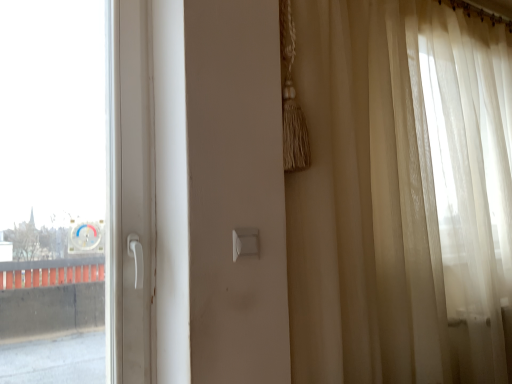
The width and height of the screenshot is (512, 384). I want to click on sheer beige curtain at right, so click(399, 196).

Describe the element at coordinates (399, 196) in the screenshot. I see `sheer beige curtain at right` at that location.

What do you see at coordinates (245, 242) in the screenshot?
I see `white plastic light switch at center` at bounding box center [245, 242].

Find the location of a particular element. This screenshot has width=512, height=384. white plastic light switch at center is located at coordinates (245, 242).

At what (x,y) coordinates should I click in order to perform the action: click on sheer beige curtain at right. Please return your answer as a coordinate pair (x, y). The height and width of the screenshot is (384, 512). Looking at the image, I should click on (399, 196).

Which object is positioned more to the left, sheer beige curtain at right or white plastic light switch at center?

Positioned to the left is white plastic light switch at center.

Which object is closer to the camera taking this photo, sheer beige curtain at right or white plastic light switch at center?

sheer beige curtain at right is closer to the camera.

Which is behind, point (362, 250) or point (233, 239)?

Point (362, 250)

From the image's perspective, relative to white plastic light switch at center, is sheer beige curtain at right above or below?

From the image's perspective, sheer beige curtain at right appears above white plastic light switch at center.

From a real-world perspective, which object stands above the other?

From a 3D spatial view, sheer beige curtain at right is above.

Which of these two, sheer beige curtain at right or white plastic light switch at center, is wider?

With larger width is sheer beige curtain at right.

In terms of height, does sheer beige curtain at right look taller or shorter compared to white plastic light switch at center?

In the image, sheer beige curtain at right appears to be taller than white plastic light switch at center.

Can you confirm if sheer beige curtain at right is bigger than white plastic light switch at center?

Yes.

Is sheer beige curtain at right inside or outside of white plastic light switch at center?

sheer beige curtain at right is spatially situated outside white plastic light switch at center.

Is sheer beige curtain at right directly adjacent to white plastic light switch at center?

No, sheer beige curtain at right is not beside white plastic light switch at center.

Is white plastic light switch at center at the back of sheer beige curtain at right?

No.

From the picture: How different are the orientations of sheer beige curtain at right and white plastic light switch at center in degrees?

2.47 degrees.

The height and width of the screenshot is (384, 512). What are the coordinates of `curtain above the white plastic light switch at center (from a real-world perspective)` in the screenshot? It's located at (399, 196).

Can you confirm if white plastic light switch at center is positioned to the left of sheer beige curtain at right?

Yes.

Relative to sheer beige curtain at right, is white plastic light switch at center in front or behind?

Clearly, white plastic light switch at center is behind sheer beige curtain at right.

Is point (238, 246) positioned before point (395, 122)?

Yes, point (238, 246) is closer to viewer.

From the image's perspective, would you say white plastic light switch at center is shown under sheer beige curtain at right?

Yes, from the image's perspective, white plastic light switch at center is below sheer beige curtain at right.

Consider the image. From a real-world perspective, is white plastic light switch at center positioned under sheer beige curtain at right based on gravity?

→ Indeed, from a real-world perspective, white plastic light switch at center is positioned beneath sheer beige curtain at right.

Does white plastic light switch at center have a lesser width compared to sheer beige curtain at right?

Indeed, white plastic light switch at center has a lesser width compared to sheer beige curtain at right.

Based on the photo, considering the relative sizes of white plastic light switch at center and sheer beige curtain at right in the image provided, is white plastic light switch at center shorter than sheer beige curtain at right?

Yes.

Does white plastic light switch at center have a smaller size compared to sheer beige curtain at right?

Yes.

Is white plastic light switch at center situated inside sheer beige curtain at right or outside?

white plastic light switch at center is located beyond the bounds of sheer beige curtain at right.

Are white plastic light switch at center and sheer beige curtain at right far apart?

That's not correct — white plastic light switch at center is a little close to sheer beige curtain at right.

Could you tell me if white plastic light switch at center is turned towards sheer beige curtain at right?

No, white plastic light switch at center is not aimed at sheer beige curtain at right.

Can you tell me how much white plastic light switch at center and sheer beige curtain at right differ in facing direction?

The angle between the facing direction of white plastic light switch at center and the facing direction of sheer beige curtain at right is 2.47 degrees.

Where is `curtain lying above the white plastic light switch at center (from the image's perspective)`? curtain lying above the white plastic light switch at center (from the image's perspective) is located at coordinates (399, 196).

Image resolution: width=512 pixels, height=384 pixels. I want to click on curtain in front of the white plastic light switch at center, so click(x=399, y=196).

The image size is (512, 384). I want to click on curtain above the white plastic light switch at center (from the image's perspective), so pos(399,196).